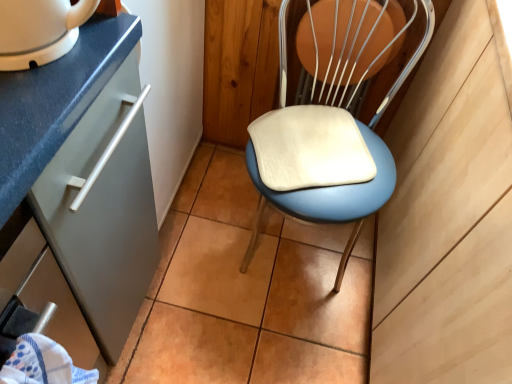
Question: From the image's perspective, is blue fabric towel at lower left on blue padded chair at center?

Choices:
 (A) no
 (B) yes

Answer: (A)

Question: From a real-world perspective, is blue fabric towel at lower left on top of blue padded chair at center?

Choices:
 (A) yes
 (B) no

Answer: (A)

Question: Is blue fabric towel at lower left taller than blue padded chair at center?

Choices:
 (A) yes
 (B) no

Answer: (B)

Question: Is blue fabric towel at lower left shorter than blue padded chair at center?

Choices:
 (A) yes
 (B) no

Answer: (A)

Question: Is blue fabric towel at lower left not within blue padded chair at center?

Choices:
 (A) yes
 (B) no

Answer: (A)

Question: Is blue fabric towel at lower left smaller than blue padded chair at center?

Choices:
 (A) yes
 (B) no

Answer: (A)

Question: Does blue padded chair at center have a greater height compared to white glossy mug at upper left?

Choices:
 (A) no
 (B) yes

Answer: (B)

Question: Is blue padded chair at center looking in the opposite direction of white glossy mug at upper left?

Choices:
 (A) no
 (B) yes

Answer: (A)

Question: Does blue padded chair at center appear on the right side of white glossy mug at upper left?

Choices:
 (A) no
 (B) yes

Answer: (B)

Question: Is blue padded chair at center located outside white glossy mug at upper left?

Choices:
 (A) yes
 (B) no

Answer: (A)

Question: Can you confirm if blue padded chair at center is wider than white glossy mug at upper left?

Choices:
 (A) no
 (B) yes

Answer: (B)

Question: Is blue padded chair at center bigger than white glossy mug at upper left?

Choices:
 (A) yes
 (B) no

Answer: (A)

Question: Is white glossy mug at upper left further to the viewer compared to blue fabric towel at lower left?

Choices:
 (A) no
 (B) yes

Answer: (B)